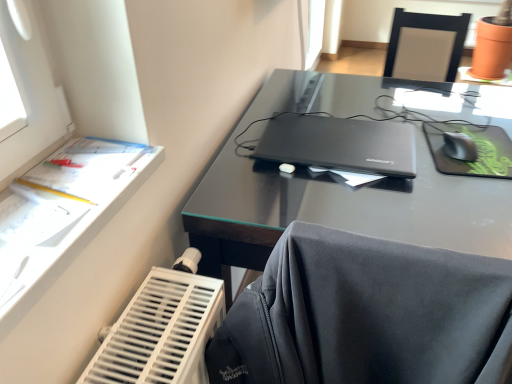
Locate an element on the screen. This screenshot has height=384, width=512. free space in front of matte black laptop at center is located at coordinates (364, 203).